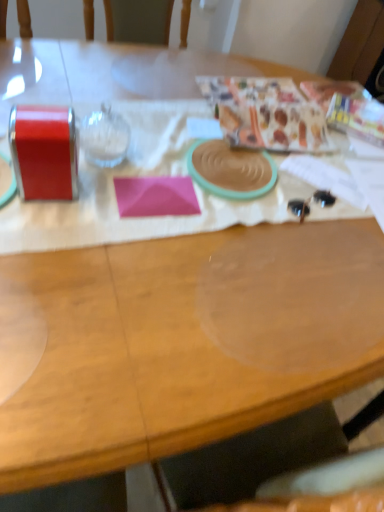
Where is `vacant area on the back side of transparent glass at upper left`? This screenshot has height=512, width=384. vacant area on the back side of transparent glass at upper left is located at coordinates (140, 114).